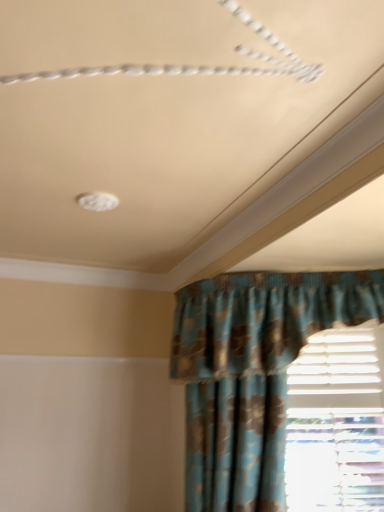
Question: Is blue textured fabric curtain at lower right wider than white plastic blinds at lower right?

Choices:
 (A) no
 (B) yes

Answer: (B)

Question: Is blue textured fabric curtain at lower right outside white plastic blinds at lower right?

Choices:
 (A) no
 (B) yes

Answer: (B)

Question: From the image's perspective, does blue textured fabric curtain at lower right appear higher than white plastic blinds at lower right?

Choices:
 (A) yes
 (B) no

Answer: (A)

Question: Does blue textured fabric curtain at lower right lie behind white plastic blinds at lower right?

Choices:
 (A) yes
 (B) no

Answer: (B)

Question: Can you confirm if blue textured fabric curtain at lower right is taller than white plastic blinds at lower right?

Choices:
 (A) yes
 (B) no

Answer: (A)

Question: From a real-world perspective, is blue textured fabric curtain at lower right positioned under white plastic blinds at lower right based on gravity?

Choices:
 (A) no
 (B) yes

Answer: (A)

Question: Is white plastic blinds at lower right in front of blue textured fabric curtain at lower right?

Choices:
 (A) no
 (B) yes

Answer: (A)

Question: Is white plastic blinds at lower right looking in the opposite direction of blue textured fabric curtain at lower right?

Choices:
 (A) no
 (B) yes

Answer: (A)

Question: Would you say white plastic blinds at lower right is outside blue textured fabric curtain at lower right?

Choices:
 (A) no
 (B) yes

Answer: (B)

Question: Considering the relative positions of white plastic blinds at lower right and blue textured fabric curtain at lower right in the image provided, is white plastic blinds at lower right to the right of blue textured fabric curtain at lower right from the viewer's perspective?

Choices:
 (A) yes
 (B) no

Answer: (A)

Question: From a real-world perspective, is white plastic blinds at lower right over blue textured fabric curtain at lower right?

Choices:
 (A) yes
 (B) no

Answer: (B)

Question: Are white plastic blinds at lower right and blue textured fabric curtain at lower right located far from each other?

Choices:
 (A) no
 (B) yes

Answer: (A)

Question: Is white plastic blinds at lower right wider or thinner than blue textured fabric curtain at lower right?

Choices:
 (A) thin
 (B) wide

Answer: (A)